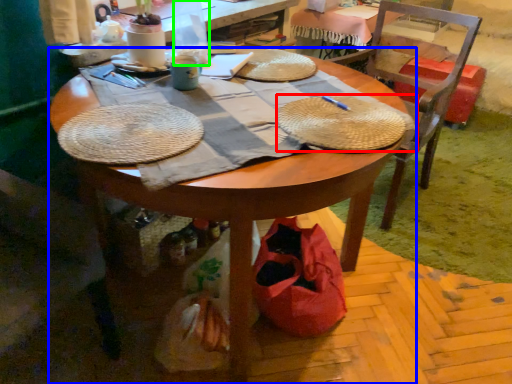
Question: Based on their relative distances, which object is farther from picnic basket (highlighted by a red box)? Choose from desk (highlighted by a blue box) and bottle (highlighted by a green box).

Choices:
 (A) desk
 (B) bottle

Answer: (B)